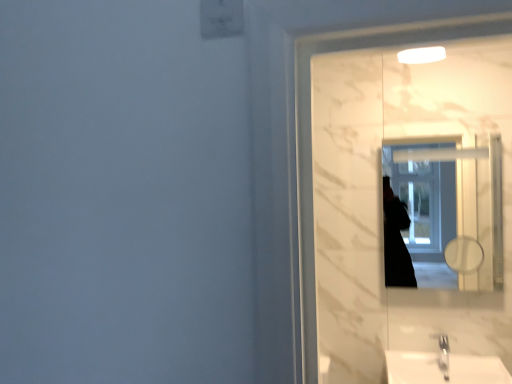
This screenshot has width=512, height=384. What do you see at coordinates (444, 367) in the screenshot?
I see `white glossy sink at lower right` at bounding box center [444, 367].

At what (x,y) coordinates should I click in order to perform the action: click on white glossy sink at lower right. Please return your answer as a coordinate pair (x, y). The height and width of the screenshot is (384, 512). Looking at the image, I should click on (444, 367).

Describe the element at coordinates (451, 207) in the screenshot. I see `white glossy mirror at upper right` at that location.

Based on the photo, what is the approximate width of white glossy mirror at upper right?

1.00 centimeters.

Find the location of a particular element. This screenshot has height=384, width=512. white glossy mirror at upper right is located at coordinates (451, 207).

This screenshot has height=384, width=512. In order to click on white glossy sink at lower right in this screenshot , I will do `click(444, 367)`.

Is white glossy mirror at upper right at the right side of white glossy sink at lower right?

In fact, white glossy mirror at upper right is to the left of white glossy sink at lower right.

Relative to white glossy sink at lower right, is white glossy mirror at upper right in front or behind?

white glossy mirror at upper right is behind white glossy sink at lower right.

Is point (477, 194) in front of point (498, 370)?

No.

From the image's perspective, is white glossy mirror at upper right located beneath white glossy sink at lower right?

No, from the image's perspective, white glossy mirror at upper right is not below white glossy sink at lower right.

Looking at this image, from a real-world perspective, who is located lower, white glossy mirror at upper right or white glossy sink at lower right?

white glossy sink at lower right.

Does white glossy mirror at upper right have a lesser width compared to white glossy sink at lower right?

Correct, the width of white glossy mirror at upper right is less than that of white glossy sink at lower right.

Can you confirm if white glossy mirror at upper right is taller than white glossy sink at lower right?

Indeed, white glossy mirror at upper right has a greater height compared to white glossy sink at lower right.

Can you confirm if white glossy mirror at upper right is bigger than white glossy sink at lower right?

Incorrect, white glossy mirror at upper right is not larger than white glossy sink at lower right.

Is white glossy sink at lower right located within white glossy mirror at upper right?

Definitely not — white glossy sink at lower right is not inside white glossy mirror at upper right.

Is white glossy mirror at upper right next to white glossy sink at lower right?

No, white glossy mirror at upper right is not making contact with white glossy sink at lower right.

Is white glossy mirror at upper right positioned with its back to white glossy sink at lower right?

That's not correct — white glossy mirror at upper right is not looking away from white glossy sink at lower right.

Can you tell me how much white glossy mirror at upper right and white glossy sink at lower right differ in facing direction?

0.535 degrees separate the facing orientations of white glossy mirror at upper right and white glossy sink at lower right.

The height and width of the screenshot is (384, 512). I want to click on mirror that is behind the white glossy sink at lower right, so 451,207.

Considering the positions of objects white glossy sink at lower right and white glossy mirror at upper right in the image provided, who is more to the left, white glossy sink at lower right or white glossy mirror at upper right?

From the viewer's perspective, white glossy mirror at upper right appears more on the left side.

Considering their positions, is white glossy sink at lower right located in front of or behind white glossy mirror at upper right?

Clearly, white glossy sink at lower right is in front of white glossy mirror at upper right.

Does point (422, 363) come closer to viewer compared to point (452, 275)?

That is True.

From the image's perspective, between white glossy sink at lower right and white glossy mirror at upper right, which one is located above?

white glossy mirror at upper right.

From a real-world perspective, is white glossy sink at lower right on top of white glossy mirror at upper right?

No, from a real-world perspective, white glossy sink at lower right is not on top of white glossy mirror at upper right.

Looking at their sizes, would you say white glossy sink at lower right is wider or thinner than white glossy mirror at upper right?

Clearly, white glossy sink at lower right has more width compared to white glossy mirror at upper right.

Which of these two, white glossy sink at lower right or white glossy mirror at upper right, stands taller?

Standing taller between the two is white glossy mirror at upper right.

Which of these two, white glossy sink at lower right or white glossy mirror at upper right, is smaller?

white glossy mirror at upper right is smaller.

Is white glossy sink at lower right not inside white glossy mirror at upper right?

Indeed, white glossy sink at lower right is completely outside white glossy mirror at upper right.

Is the surface of white glossy sink at lower right in direct contact with white glossy mirror at upper right?

white glossy sink at lower right is not next to white glossy mirror at upper right, and they're not touching.

Is white glossy sink at lower right looking in the opposite direction of white glossy mirror at upper right?

That's not correct — white glossy sink at lower right is not looking away from white glossy mirror at upper right.

Find the location of a particular element. sink on the right of white glossy mirror at upper right is located at coordinates (x=444, y=367).

At what (x,y) coordinates should I click in order to perform the action: click on sink located underneath the white glossy mirror at upper right (from a real-world perspective). Please return your answer as a coordinate pair (x, y). The height and width of the screenshot is (384, 512). Looking at the image, I should click on (444, 367).

At what (x,y) coordinates should I click in order to perform the action: click on mirror above the white glossy sink at lower right (from the image's perspective). Please return your answer as a coordinate pair (x, y). The image size is (512, 384). Looking at the image, I should click on (x=451, y=207).